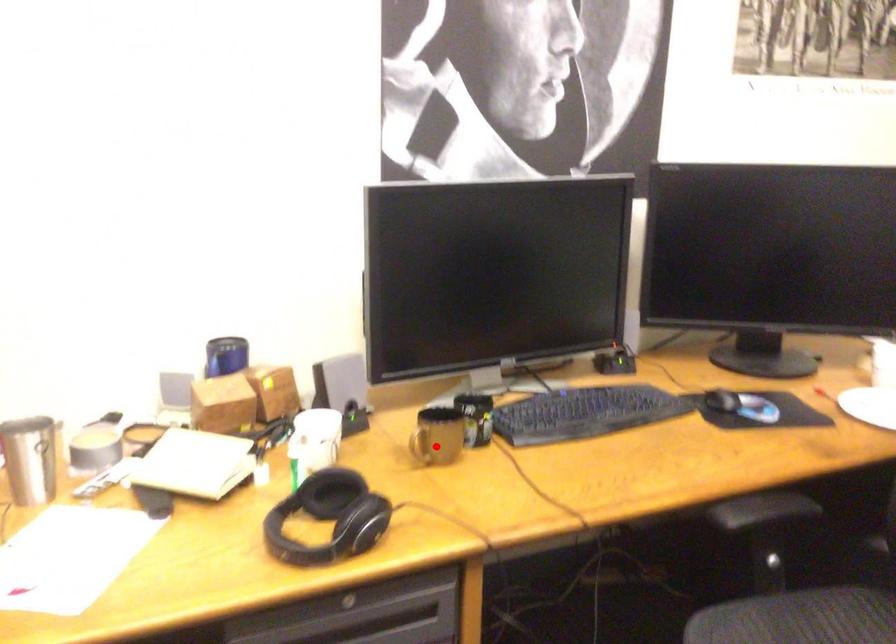
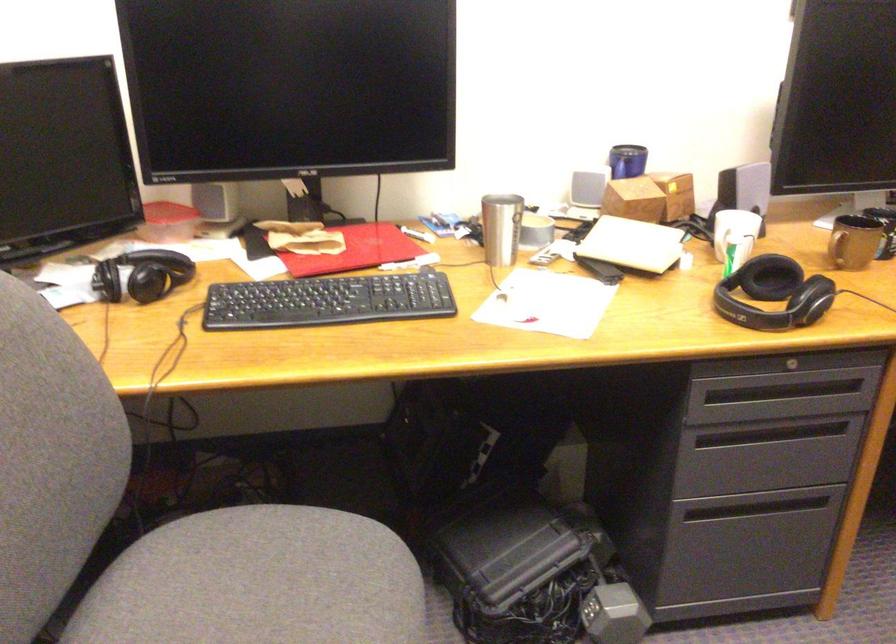
In the second image, find the point that corresponds to the highlighted location in the first image.

(854, 242)